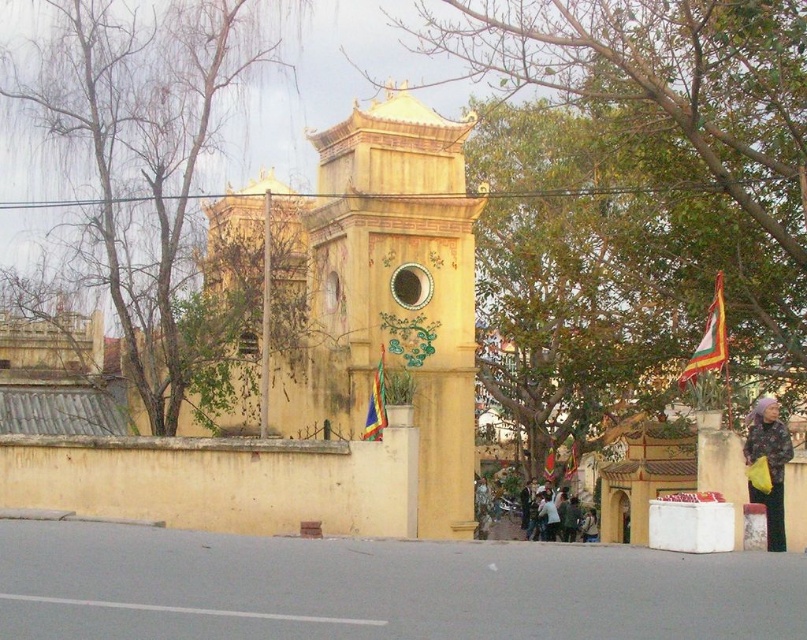
Is the position of yellow matte tower at center more distant than that of green leafy tree at upper left?

No.

Image resolution: width=807 pixels, height=640 pixels. I want to click on yellow matte tower at center, so click(320, 358).

Locate an element on the screen. The width and height of the screenshot is (807, 640). yellow matte tower at center is located at coordinates tap(320, 358).

Is point (320, 280) farther from camera compared to point (392, 337)?

Yes, it is.

In the scene shown: Who is lower down, yellow matte tower at center or yellow matte bell tower at center?

yellow matte bell tower at center

Is point (400, 353) farther from viewer compared to point (308, 237)?

That is False.

Identify the location of yellow matte tower at center. (320, 358).

Between dark gray fabric bag at lower right and triangular fabric flag at center, which one has more height?

Standing taller between the two is dark gray fabric bag at lower right.

Who is more distant from viewer, (753, 408) or (371, 387)?

Positioned behind is point (371, 387).

Does point (776, 474) lie behind point (371, 412)?

No, it is in front of (371, 412).

Identify the location of dark gray fabric bag at lower right. The width and height of the screenshot is (807, 640). (768, 465).